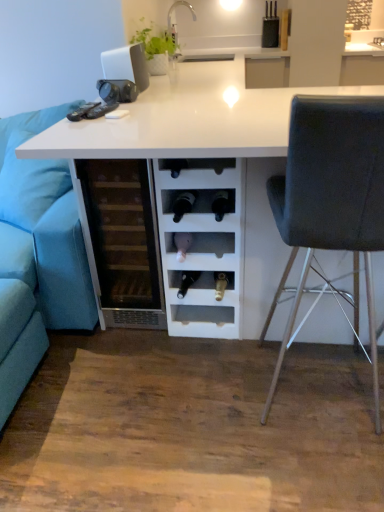
Measure the distance between white glossy table at center and camera.

white glossy table at center and camera are 35.89 inches apart from each other.

What do you see at coordinates (126, 65) in the screenshot? Image resolution: width=384 pixels, height=512 pixels. I see `white matte laptop at upper center` at bounding box center [126, 65].

This screenshot has height=512, width=384. What do you see at coordinates (38, 252) in the screenshot? I see `blue fabric couch at left` at bounding box center [38, 252].

What is the approximate width of dark grey fabric chair at right?

The width of dark grey fabric chair at right is 21.12 inches.

Describe the element at coordinates (332, 194) in the screenshot. The image size is (384, 512). I see `dark grey fabric chair at right` at that location.

The width and height of the screenshot is (384, 512). I want to click on white glossy table at center, so click(x=204, y=149).

Does point (45, 232) appear closer or farther from the camera than point (138, 63)?

Point (45, 232) appears to be closer to the viewer than point (138, 63).

Which of these two, blue fabric couch at left or white matte laptop at upper center, is thinner?

white matte laptop at upper center is thinner.

Is white matte laptop at upper center at the back of blue fabric couch at left?

No, blue fabric couch at left is not facing the opposite direction of white matte laptop at upper center.

Who is taller, blue fabric couch at left or white matte laptop at upper center?

blue fabric couch at left.

Identify the location of table located in front of the transparent glass wine cooler at center. The height and width of the screenshot is (512, 384). (204, 149).

Is there a large distance between transparent glass wine cooler at center and white glossy table at center?

No.

Does transparent glass wine cooler at center contain white glossy table at center?

Definitely not — white glossy table at center is not inside transparent glass wine cooler at center.

Considering the points (153, 220) and (21, 151), which point is in front, point (153, 220) or point (21, 151)?

Point (21, 151)

From the image's perspective, is white matte laptop at upper center above or below blue fabric couch at left?

From the image's perspective, white matte laptop at upper center appears above blue fabric couch at left.

Between white matte laptop at upper center and blue fabric couch at left, which one appears on the left side from the viewer's perspective?

blue fabric couch at left.

Is blue fabric couch at left at the back of white matte laptop at upper center?

No, white matte laptop at upper center is not facing the opposite direction of blue fabric couch at left.

From a real-world perspective, is white glossy table at center located beneath transparent glass wine cooler at center?

Actually, white glossy table at center is physically above transparent glass wine cooler at center in the real world.

Could you tell me if white glossy table at center is facing transparent glass wine cooler at center?

No, white glossy table at center is not aimed at transparent glass wine cooler at center.

Is white glossy table at center located outside transparent glass wine cooler at center?

white glossy table at center is positioned outside transparent glass wine cooler at center.

Which object is positioned more to the right, white glossy table at center or transparent glass wine cooler at center?

white glossy table at center.

Based on the photo, how different are the orientations of white glossy table at center and dark grey fabric chair at right in degrees?

white glossy table at center and dark grey fabric chair at right are facing 87.5 degrees away from each other.

Based on the photo, is white glossy table at center situated inside dark grey fabric chair at right or outside?

white glossy table at center lies outside dark grey fabric chair at right.

From the image's perspective, is white glossy table at center under dark grey fabric chair at right?

No, from the image's perspective, white glossy table at center is not below dark grey fabric chair at right.

From a real-world perspective, is white glossy table at center positioned under dark grey fabric chair at right based on gravity?

Yes, from a real-world perspective, white glossy table at center is beneath dark grey fabric chair at right.

Consider the image. From a real-world perspective, is blue fabric couch at left located higher than transparent glass wine cooler at center?

Actually, blue fabric couch at left is physically below transparent glass wine cooler at center in the real world.

From the image's perspective, is blue fabric couch at left on top of transparent glass wine cooler at center?

No, from the image's perspective, blue fabric couch at left is not above transparent glass wine cooler at center.

Considering the sizes of blue fabric couch at left and transparent glass wine cooler at center in the image, is blue fabric couch at left taller or shorter than transparent glass wine cooler at center?

In the image, blue fabric couch at left appears to be taller than transparent glass wine cooler at center.

Does blue fabric couch at left contain transparent glass wine cooler at center?

No, blue fabric couch at left does not contain transparent glass wine cooler at center.

Is dark grey fabric chair at right in contact with transparent glass wine cooler at center?

No, dark grey fabric chair at right is not touching transparent glass wine cooler at center.

Considering the sizes of objects dark grey fabric chair at right and transparent glass wine cooler at center in the image provided, who is shorter, dark grey fabric chair at right or transparent glass wine cooler at center?

transparent glass wine cooler at center.

Which is behind, dark grey fabric chair at right or transparent glass wine cooler at center?

transparent glass wine cooler at center.

Is transparent glass wine cooler at center surrounded by dark grey fabric chair at right?

No.

At what (x,y) coordinates should I click in order to perform the action: click on appliance above the blue fabric couch at left (from the image's perspective). Please return your answer as a coordinate pair (x, y). Looking at the image, I should click on (126, 65).

You are a GUI agent. You are given a task and a screenshot of the screen. Output one action in this format:
    pyautogui.click(x=<x>, y=<y>)
    Task: Click on the table located above the transparent glass wine cooler at center (from a real-world perspective)
    
    Given the screenshot: What is the action you would take?
    pyautogui.click(x=204, y=149)

Which object lies further to the anchor point white glossy table at center, white matte laptop at upper center or blue fabric couch at left?

blue fabric couch at left.

Which object lies nearer to the anchor point white matte laptop at upper center, blue fabric couch at left or white glossy table at center?

white glossy table at center is positioned closer to the anchor white matte laptop at upper center.

Based on their spatial positions, is dark grey fabric chair at right or transparent glass wine cooler at center closer to white glossy table at center?

The object closer to white glossy table at center is transparent glass wine cooler at center.

When comparing their distances from white matte laptop at upper center, does white glossy table at center or blue fabric couch at left seem further?

blue fabric couch at left is positioned further to the anchor white matte laptop at upper center.

From the image, which object appears to be nearer to transparent glass wine cooler at center, blue fabric couch at left or dark grey fabric chair at right?

blue fabric couch at left lies closer to transparent glass wine cooler at center than the other object.

From the image, which object appears to be farther from blue fabric couch at left, white matte laptop at upper center or transparent glass wine cooler at center?

white matte laptop at upper center.

When comparing their distances from white matte laptop at upper center, does dark grey fabric chair at right or transparent glass wine cooler at center seem closer?

Among the two, transparent glass wine cooler at center is located nearer to white matte laptop at upper center.

Estimate the real-world distances between objects in this image. Which object is further from blue fabric couch at left, dark grey fabric chair at right or white glossy table at center?

dark grey fabric chair at right lies further to blue fabric couch at left than the other object.

The width and height of the screenshot is (384, 512). Identify the location of file cabinet located between blue fabric couch at left and white glossy table at center in the left-right direction. point(122,241).

This screenshot has width=384, height=512. Find the location of `chair between blue fabric couch at left and white glossy table at center`. chair between blue fabric couch at left and white glossy table at center is located at coordinates (332, 194).

This screenshot has width=384, height=512. I want to click on file cabinet between white matte laptop at upper center and white glossy table at center in the horizontal direction, so click(122, 241).

Identify the location of file cabinet between dark grey fabric chair at right and white matte laptop at upper center from front to back. This screenshot has width=384, height=512. (122, 241).